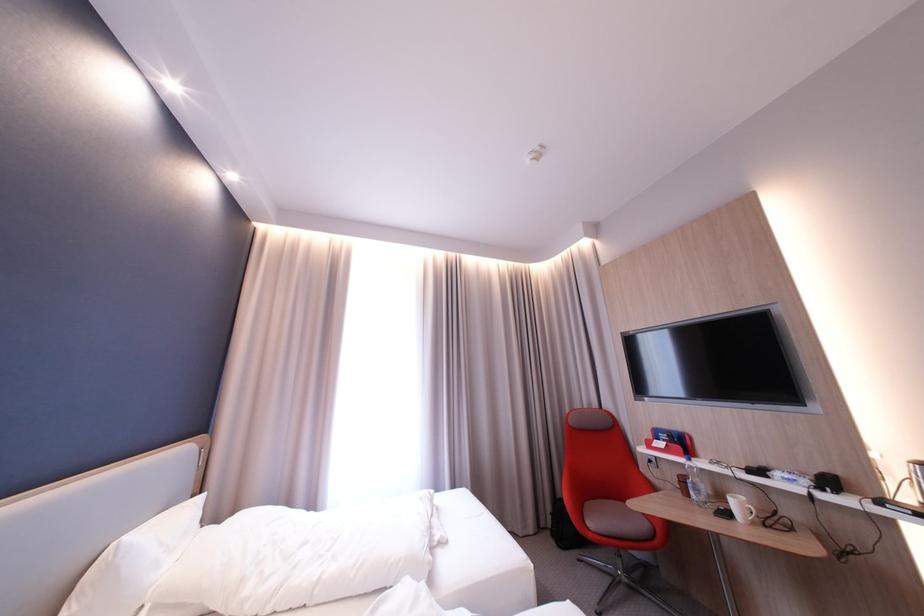
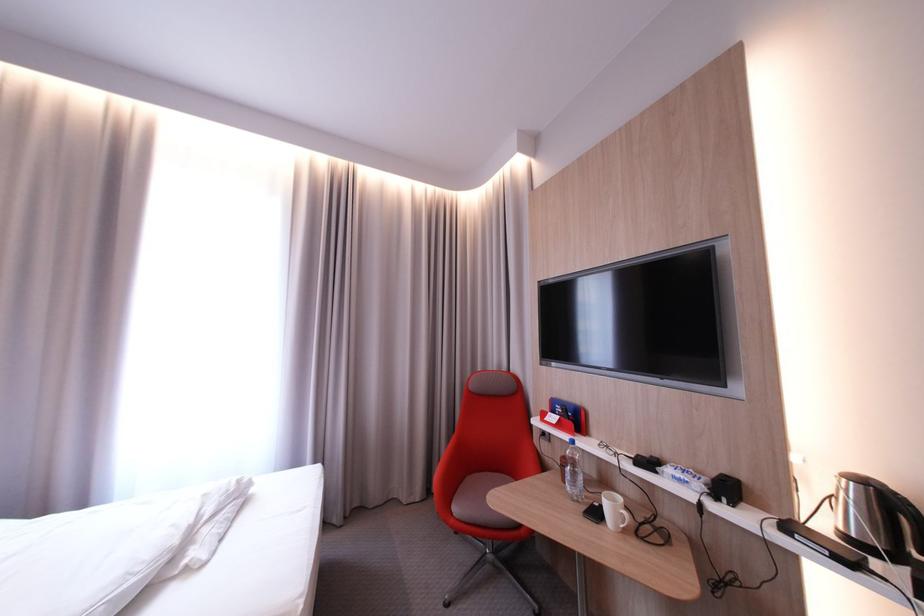
Question: I am providing you with two images of the same scene from different viewpoints. Please identify which objects are invisible in image2.

Choices:
 (A) red chair sitting surface
 (B) white pillow
 (C) black smartphone
 (D) none of these

Answer: (D)